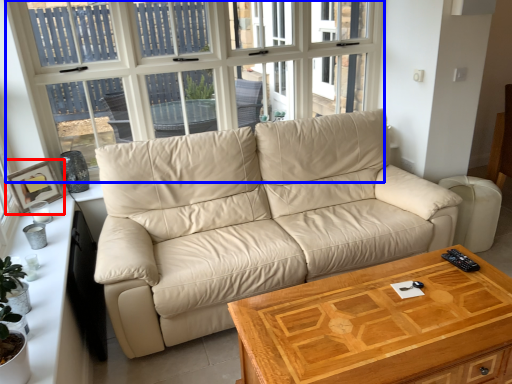
Question: Among these objects, which one is farthest to the camera, picture frame (highlighted by a red box) or window (highlighted by a blue box)?

Choices:
 (A) picture frame
 (B) window

Answer: (A)